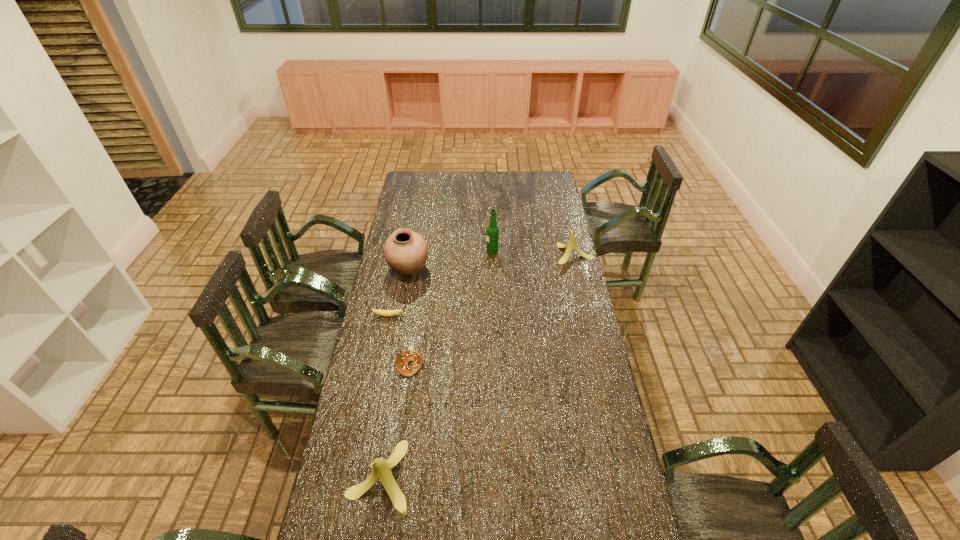
Locate an element on the screen. This screenshot has width=960, height=540. vacant space located 0.140m on the right of the tallest banana is located at coordinates (457, 476).

The width and height of the screenshot is (960, 540). Identify the location of free space located on the left of the rightmost object. (x=506, y=254).

The image size is (960, 540). I want to click on free spot located on the label of the second object from right to left, so click(x=440, y=252).

Where is `vacant area situated on the label of the second object from right to left`? The image size is (960, 540). vacant area situated on the label of the second object from right to left is located at coordinates (434, 252).

Where is `vacant space located on the label of the second object from right to left`? The image size is (960, 540). vacant space located on the label of the second object from right to left is located at coordinates (472, 252).

Locate an element on the screen. vacant space located 0.060m on the back of the shortest banana is located at coordinates (391, 303).

Find the location of a particular element. blank space located 0.290m on the back of the pottery is located at coordinates (417, 219).

Locate an element on the screen. free space located 0.080m on the right of the fifth farthest object is located at coordinates tap(444, 365).

This screenshot has height=540, width=960. What are the coordinates of `object that is at the near edge` in the screenshot? It's located at pos(381,470).

Find the location of a particular element. pottery positioned at the left edge is located at coordinates (405, 251).